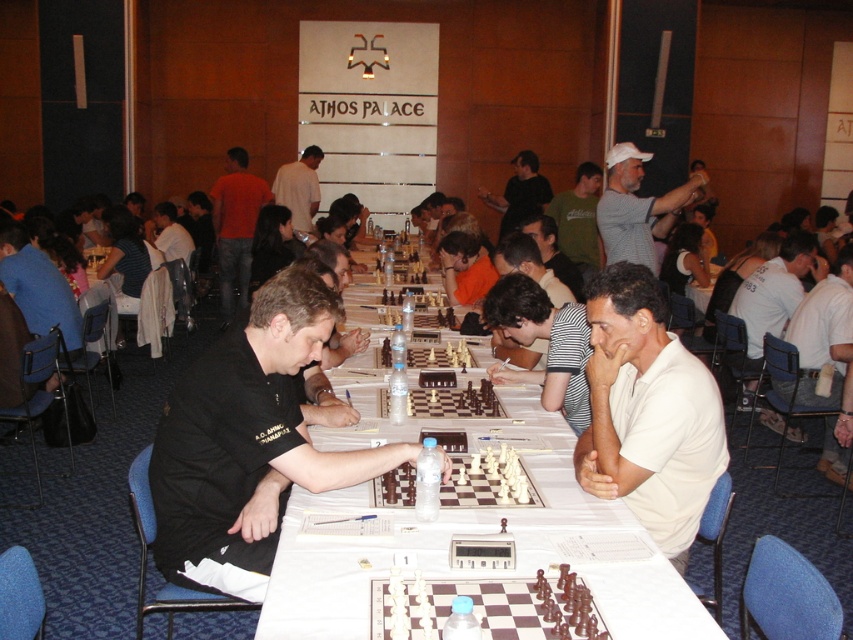
Question: Is clear plastic water bottle at center smaller than green cotton shirt at center?

Choices:
 (A) yes
 (B) no

Answer: (A)

Question: Which of the following is the closest to the observer?

Choices:
 (A) (845, 282)
 (B) (643, 262)

Answer: (A)

Question: Does white cloth table at center have a greater width compared to white matte shirt at center?

Choices:
 (A) no
 (B) yes

Answer: (B)

Question: Which of the following is the closest to the observer?

Choices:
 (A) white cotton shirt at center
 (B) striped cotton shirt at center

Answer: (B)

Question: Estimate the real-world distances between objects in this image. Which object is closer to the black shirt at center?

Choices:
 (A) dark wood chess set at center
 (B) white cotton shirt at right
 (C) white shirt at center
 (D) gray cotton shirt at upper right

Answer: (A)

Question: Is black shirt at center further to camera compared to orange shirt at center?

Choices:
 (A) yes
 (B) no

Answer: (B)